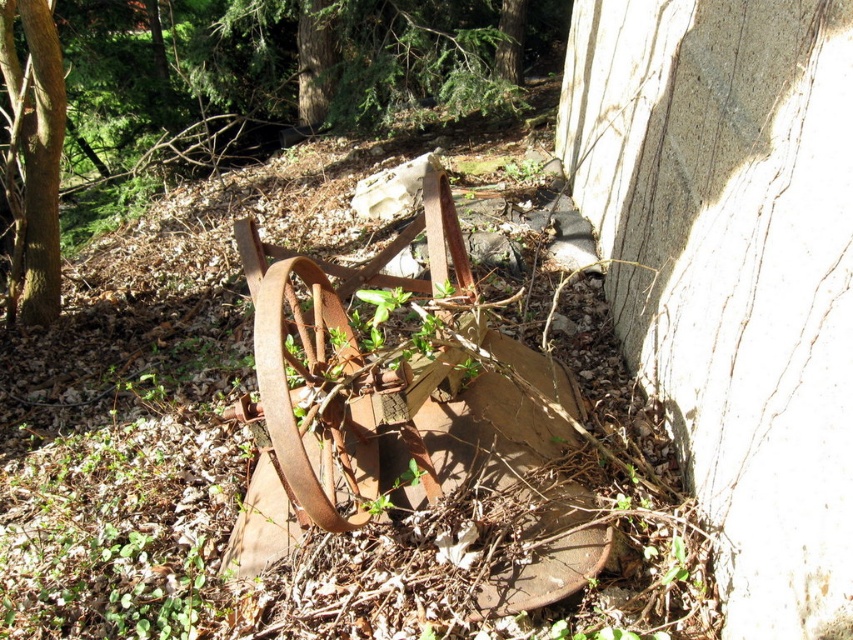
The height and width of the screenshot is (640, 853). Describe the element at coordinates (33, 152) in the screenshot. I see `green rough bark tree at left` at that location.

Which is in front, point (39, 84) or point (508, 1)?

Positioned in front is point (39, 84).

You are a GUI agent. You are given a task and a screenshot of the screen. Output one action in this format:
    pyautogui.click(x=<x>, y=<y>)
    Task: Click on the green rough bark tree at left
    Image resolution: width=853 pixels, height=640 pixels.
    Given the screenshot: What is the action you would take?
    pyautogui.click(x=33, y=152)

Who is higher up, rusty metal cart at center or rusty metal wagon wheel at center?

rusty metal cart at center is above.

Looking at this image, can you confirm if rusty metal cart at center is taller than rusty metal wagon wheel at center?

No.

This screenshot has width=853, height=640. I want to click on rusty metal cart at center, so click(x=227, y=83).

Can you confirm if rusty metal wagon wheel at center is positioned to the left of green rough bark tree at left?

No, rusty metal wagon wheel at center is not to the left of green rough bark tree at left.

Between point (270, 360) and point (57, 38), which one is positioned in front?

Positioned in front is point (270, 360).

Find the location of `rusty metal wagon wheel at center`. rusty metal wagon wheel at center is located at coordinates (312, 392).